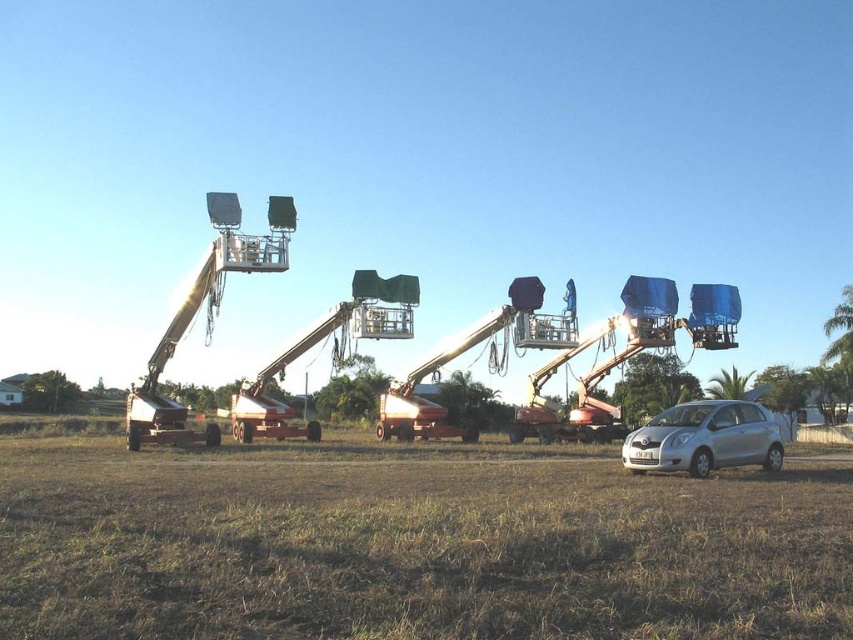
Question: Among these objects, which one is farthest from the camera?

Choices:
 (A) brown grass at lower center
 (B) silver metallic car at lower right

Answer: (B)

Question: Which point appears closest to the camera in this image?

Choices:
 (A) (622, 452)
 (B) (349, 508)

Answer: (B)

Question: Can you confirm if brown grass at lower center is bigger than silver metallic car at lower right?

Choices:
 (A) yes
 (B) no

Answer: (A)

Question: Can you confirm if brown grass at lower center is bigger than silver metallic car at lower right?

Choices:
 (A) yes
 (B) no

Answer: (A)

Question: Is brown grass at lower center positioned in front of silver metallic car at lower right?

Choices:
 (A) no
 (B) yes

Answer: (B)